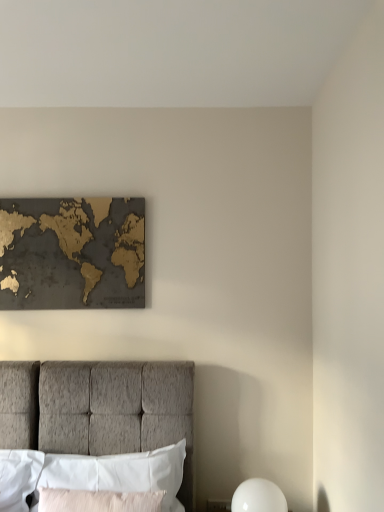
Question: From a real-world perspective, is gold metallic map at upper center physically above white glossy sphere at lower right?

Choices:
 (A) no
 (B) yes

Answer: (B)

Question: Considering the relative positions of gold metallic map at upper center and white glossy sphere at lower right in the image provided, is gold metallic map at upper center to the left of white glossy sphere at lower right from the viewer's perspective?

Choices:
 (A) no
 (B) yes

Answer: (B)

Question: Considering the relative positions of gold metallic map at upper center and white glossy sphere at lower right in the image provided, is gold metallic map at upper center to the right of white glossy sphere at lower right from the viewer's perspective?

Choices:
 (A) no
 (B) yes

Answer: (A)

Question: Is gold metallic map at upper center smaller than white glossy sphere at lower right?

Choices:
 (A) yes
 (B) no

Answer: (B)

Question: Is gold metallic map at upper center oriented away from white glossy sphere at lower right?

Choices:
 (A) yes
 (B) no

Answer: (B)

Question: Considering the relative sizes of gold metallic map at upper center and white glossy sphere at lower right in the image provided, is gold metallic map at upper center wider than white glossy sphere at lower right?

Choices:
 (A) no
 (B) yes

Answer: (A)

Question: From the image's perspective, would you say white fabric pillow at lower left, positioned as the first pillow in back-to-front order, is positioned over light pink fabric pillow at lower center, positioned as the 2th pillow in back-to-front order?

Choices:
 (A) no
 (B) yes

Answer: (B)

Question: Does white fabric pillow at lower left, the 2th pillow in the front-to-back sequence, have a greater width compared to light pink fabric pillow at lower center, positioned as the 2th pillow in back-to-front order?

Choices:
 (A) yes
 (B) no

Answer: (A)

Question: From the image's perspective, is white fabric pillow at lower left, the 2th pillow in the front-to-back sequence, beneath light pink fabric pillow at lower center, positioned as the 2th pillow in back-to-front order?

Choices:
 (A) yes
 (B) no

Answer: (B)

Question: Does white fabric pillow at lower left, the 2th pillow in the front-to-back sequence, appear on the right side of light pink fabric pillow at lower center, positioned as the 2th pillow in back-to-front order?

Choices:
 (A) no
 (B) yes

Answer: (B)

Question: Is white fabric pillow at lower left, the 2th pillow in the front-to-back sequence, oriented towards light pink fabric pillow at lower center, positioned as the 2th pillow in back-to-front order?

Choices:
 (A) no
 (B) yes

Answer: (B)

Question: Is white fabric pillow at lower left, the 2th pillow in the front-to-back sequence, oriented away from light pink fabric pillow at lower center, the first pillow positioned from the front?

Choices:
 (A) no
 (B) yes

Answer: (B)

Question: Is light pink fabric pillow at lower center, positioned as the 2th pillow in back-to-front order, thinner than white fabric pillow at lower left, the 2th pillow in the front-to-back sequence?

Choices:
 (A) no
 (B) yes

Answer: (B)